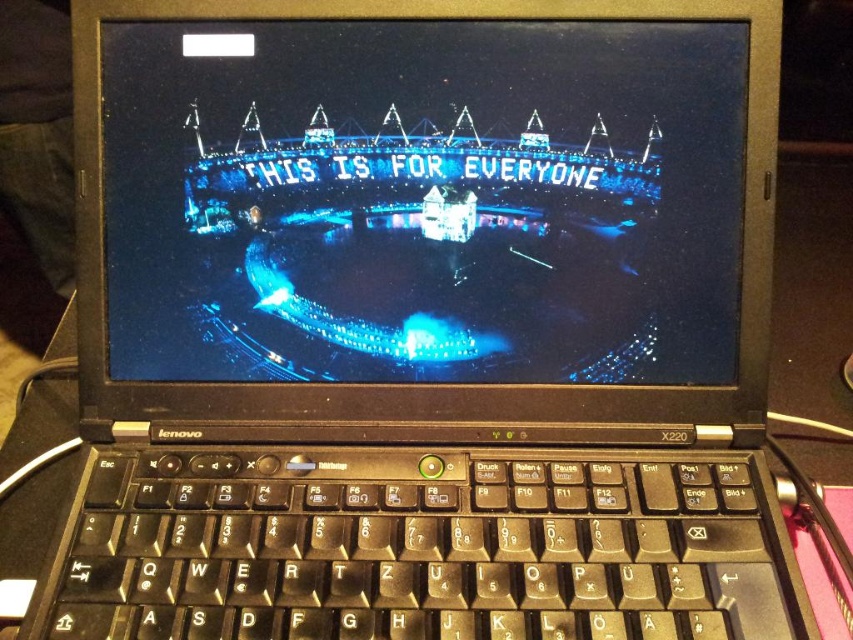
Question: Among these points, which one is nearest to the camera?

Choices:
 (A) (325, 637)
 (B) (375, 147)

Answer: (A)

Question: Is blue glossy screen at center bigger than black plastic keyboard at center?

Choices:
 (A) no
 (B) yes

Answer: (A)

Question: Is the position of blue glossy screen at center more distant than that of black plastic keyboard at center?

Choices:
 (A) no
 (B) yes

Answer: (B)

Question: Is blue glossy screen at center above black plastic keyboard at center?

Choices:
 (A) no
 (B) yes

Answer: (B)

Question: Among these points, which one is farthest from the camera?

Choices:
 (A) (685, 550)
 (B) (569, 96)

Answer: (B)